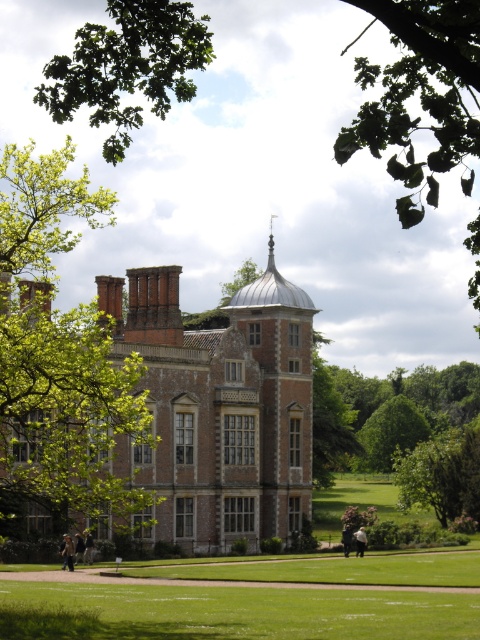
Question: Can you confirm if green leafy tree at left is positioned to the left of green grass lawn at center?

Choices:
 (A) yes
 (B) no

Answer: (A)

Question: Which point appears closest to the camera in this image?

Choices:
 (A) (39, 426)
 (B) (146, 35)

Answer: (B)

Question: Which is nearer to the green grass lawn at center?

Choices:
 (A) green leafy tree at upper left
 (B) green leafy tree at left

Answer: (B)

Question: Considering the relative positions of green leafy tree at upper left and green grass lawn at center in the image provided, where is green leafy tree at upper left located with respect to green grass lawn at center?

Choices:
 (A) right
 (B) left

Answer: (B)

Question: Does green leafy tree at left appear under green leafy tree at upper left?

Choices:
 (A) no
 (B) yes

Answer: (B)

Question: Which object is the closest to the green leafy tree at upper left?

Choices:
 (A) green grass lawn at center
 (B) green leafy tree at left

Answer: (B)